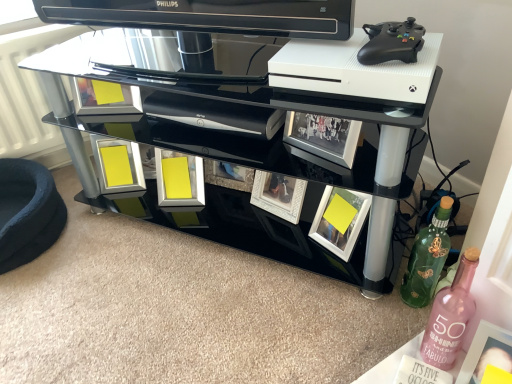
This screenshot has width=512, height=384. Identify the location of vacant space in between metallic yellow picture frame at lower left, positioned as the 1th picture frame in left-to-right order, and pink glass bottle at lower right, which is counted as the second bottle, starting from the back. (258, 264).